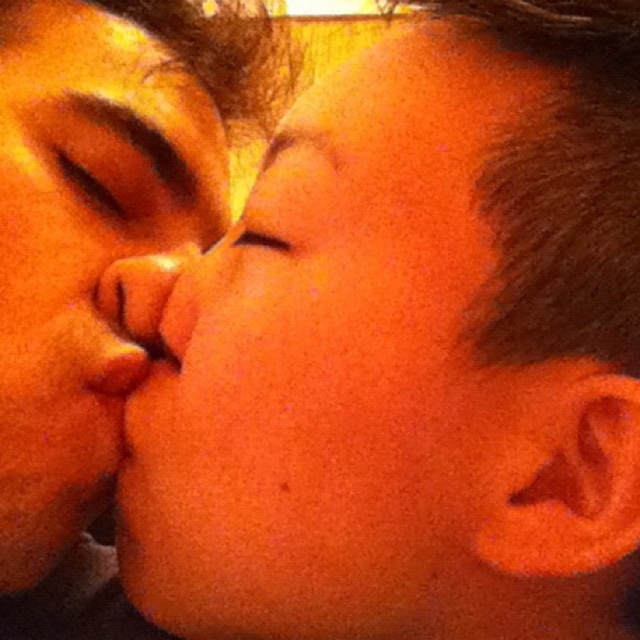
The image size is (640, 640). Describe the element at coordinates (339, 371) in the screenshot. I see `smooth skin face at center` at that location.

Can you confirm if smooth skin face at center is positioned above brown matte eye at upper left?

Incorrect, smooth skin face at center is not positioned above brown matte eye at upper left.

You are a GUI agent. You are given a task and a screenshot of the screen. Output one action in this format:
    pyautogui.click(x=<x>, y=<y>)
    Task: Click on the smooth skin face at center
    
    Given the screenshot: What is the action you would take?
    pyautogui.click(x=339, y=371)

Which is above, smooth skin face at center or matte orange eye at center?

matte orange eye at center

Between point (362, 220) and point (272, 248), which one is positioned in front?

Positioned in front is point (362, 220).

This screenshot has height=640, width=640. I want to click on smooth skin face at center, so click(339, 371).

In the scene shown: Is matte orange nose at center wider than matte orange eye at center?

Indeed, matte orange nose at center has a greater width compared to matte orange eye at center.

Does matte orange nose at center have a lesser width compared to matte orange eye at center?

No.

The image size is (640, 640). I want to click on matte orange nose at center, so click(x=140, y=292).

The height and width of the screenshot is (640, 640). Identify the location of matte orange nose at center. (140, 292).